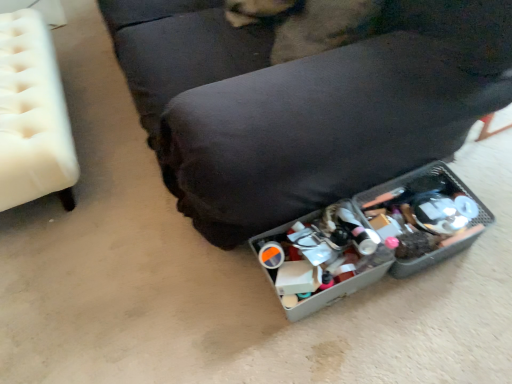
Question: Can you confirm if fuzzy brown dog at center is positioned to the left of metallic gray storage bin at lower right, the 2th furniture from the left?

Choices:
 (A) no
 (B) yes

Answer: (A)

Question: From a real-world perspective, is fuzzy brown dog at center physically above metallic gray storage bin at lower right, which appears as the 1th furniture when viewed from the right?

Choices:
 (A) no
 (B) yes

Answer: (A)

Question: From the image's perspective, does fuzzy brown dog at center appear higher than metallic gray storage bin at lower right, the 2th furniture from the left?

Choices:
 (A) no
 (B) yes

Answer: (A)

Question: Is fuzzy brown dog at center located outside metallic gray storage bin at lower right, which appears as the 1th furniture when viewed from the right?

Choices:
 (A) no
 (B) yes

Answer: (A)

Question: Considering the relative sizes of fuzzy brown dog at center and metallic gray storage bin at lower right, the 2th furniture from the left, in the image provided, is fuzzy brown dog at center shorter than metallic gray storage bin at lower right, the 2th furniture from the left,?

Choices:
 (A) no
 (B) yes

Answer: (B)

Question: From their relative heights in the image, would you say metallic gray storage bin at lower right, the 2th furniture from the left, is taller or shorter than white tufted ottoman at left, which is the first furniture from left to right?

Choices:
 (A) tall
 (B) short

Answer: (A)

Question: From a real-world perspective, is metallic gray storage bin at lower right, which appears as the 1th furniture when viewed from the right, physically located above or below white tufted ottoman at left, which is the first furniture from left to right?

Choices:
 (A) below
 (B) above

Answer: (B)

Question: Considering the positions of point pos(382,41) and point pos(70,135), is point pos(382,41) closer or farther from the camera than point pos(70,135)?

Choices:
 (A) farther
 (B) closer

Answer: (B)

Question: Based on their positions, is metallic gray storage bin at lower right, the 2th furniture from the left, located to the left or right of white tufted ottoman at left, which appears as the second furniture when viewed from the right?

Choices:
 (A) right
 (B) left

Answer: (A)

Question: Considering the positions of white tufted ottoman at left, which is the first furniture from left to right, and fuzzy brown dog at center in the image, is white tufted ottoman at left, which is the first furniture from left to right, taller or shorter than fuzzy brown dog at center?

Choices:
 (A) tall
 (B) short

Answer: (A)

Question: In terms of size, does white tufted ottoman at left, which appears as the second furniture when viewed from the right, appear bigger or smaller than fuzzy brown dog at center?

Choices:
 (A) big
 (B) small

Answer: (A)

Question: From a real-world perspective, is white tufted ottoman at left, which is the first furniture from left to right, above or below fuzzy brown dog at center?

Choices:
 (A) above
 (B) below

Answer: (B)

Question: From the image's perspective, is white tufted ottoman at left, which appears as the second furniture when viewed from the right, above or below fuzzy brown dog at center?

Choices:
 (A) above
 (B) below

Answer: (B)

Question: Considering the positions of metallic gray storage bin at lower right, which appears as the 1th furniture when viewed from the right, and fuzzy brown dog at center in the image, is metallic gray storage bin at lower right, which appears as the 1th furniture when viewed from the right, bigger or smaller than fuzzy brown dog at center?

Choices:
 (A) big
 (B) small

Answer: (A)

Question: From a real-world perspective, is metallic gray storage bin at lower right, which appears as the 1th furniture when viewed from the right, positioned above or below fuzzy brown dog at center?

Choices:
 (A) below
 (B) above

Answer: (B)